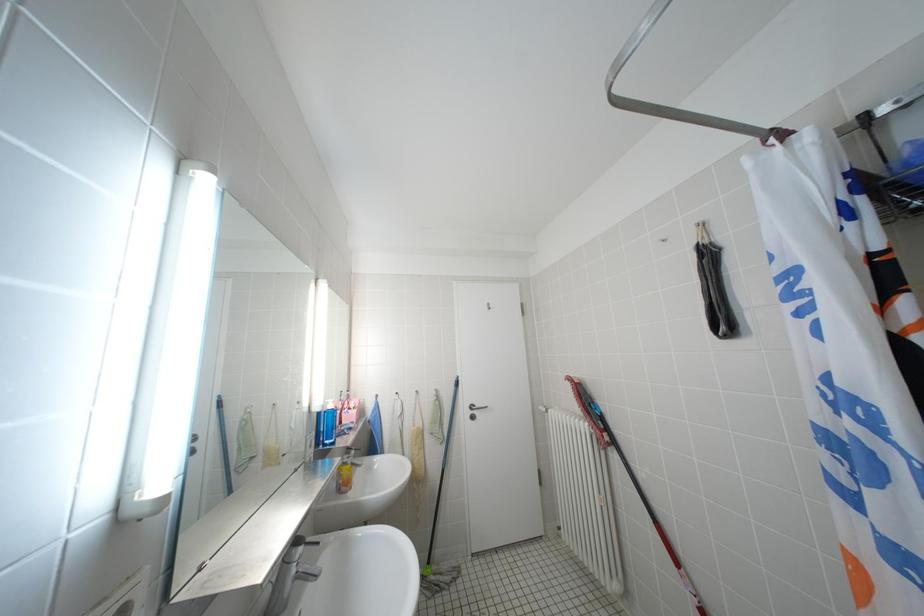
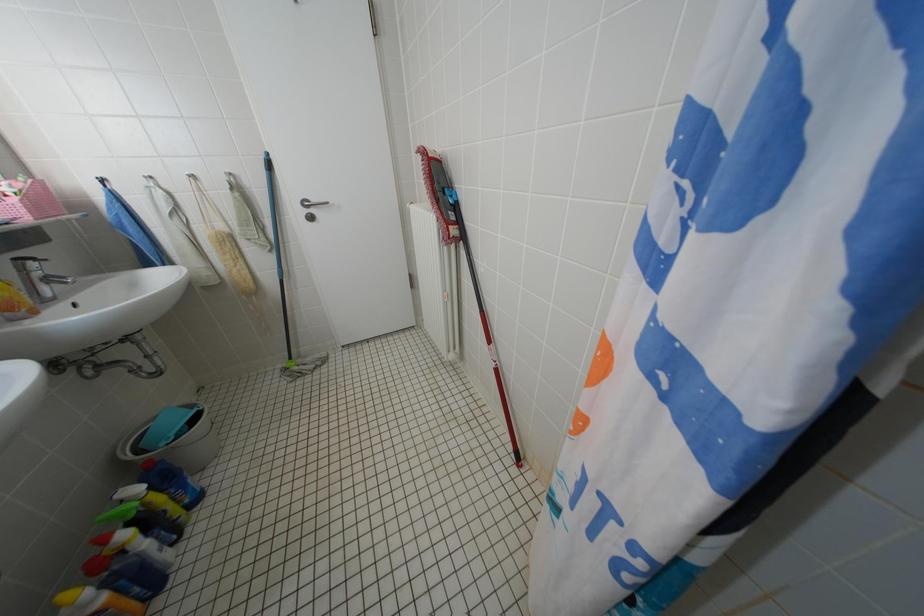
The first image is from the beginning of the video and the second image is from the end. How did the camera likely rotate when shooting the video?

The camera rotated toward right-down.